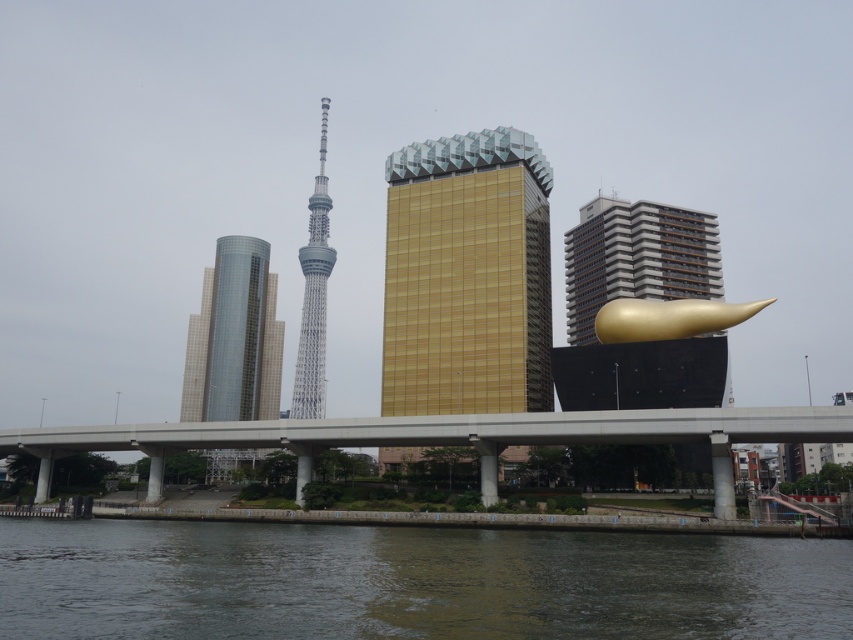
In the scene shown: Between glossy glass tower at center-left and gold metallic sculpture at right, which one appears on the right side from the viewer's perspective?

Positioned to the right is gold metallic sculpture at right.

Is point (247, 403) farther from camera compared to point (579, 282)?

Yes, point (247, 403) is farther from viewer.

Does point (229, 371) come in front of point (573, 298)?

No, it is behind (573, 298).

Where is `glossy glass tower at center-left`? The image size is (853, 640). glossy glass tower at center-left is located at coordinates (234, 337).

Image resolution: width=853 pixels, height=640 pixels. What do you see at coordinates (410, 582) in the screenshot? I see `dark gray water at lower center` at bounding box center [410, 582].

Which is above, dark gray water at lower center or concrete bridge at center?

Positioned higher is dark gray water at lower center.

Which is behind, point (834, 611) or point (286, 432)?

Point (286, 432)

Find the location of a particular element. The height and width of the screenshot is (640, 853). dark gray water at lower center is located at coordinates (410, 582).

Is gold textured building at center shorter than gold polished sculpture at right?

Incorrect, gold textured building at center's height does not fall short of gold polished sculpture at right's.

Does gold textured building at center appear under gold polished sculpture at right?

No, gold textured building at center is not below gold polished sculpture at right.

Is point (473, 145) closer to viewer compared to point (717, 314)?

No, (473, 145) is further to viewer.

Find the location of a particular element. gold textured building at center is located at coordinates 467,276.